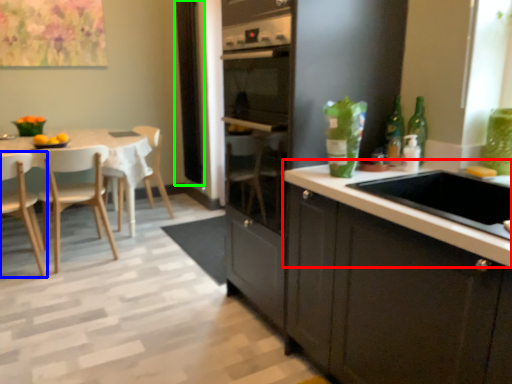
Question: Considering the real-world distances, which object is farthest from countertop (highlighted by a red box)? chair (highlighted by a blue box) or window screen (highlighted by a green box)?

Choices:
 (A) chair
 (B) window screen

Answer: (B)